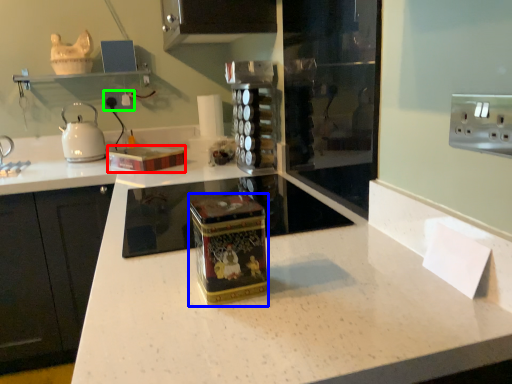
Question: Considering the real-world distances, which object is farthest from box (highlighted by a red box)? appliance (highlighted by a blue box) or electric outlet (highlighted by a green box)?

Choices:
 (A) appliance
 (B) electric outlet

Answer: (A)